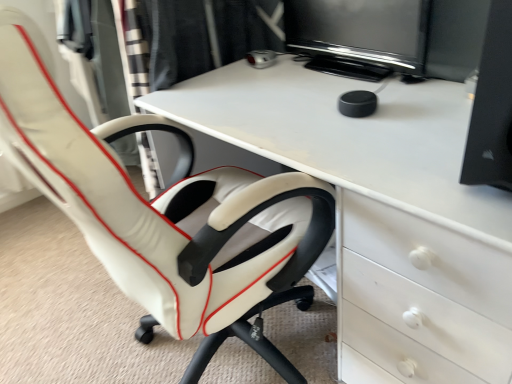
Where is `free space underneath black glossy monitor at upper center (from a real-world perspective)`? The image size is (512, 384). free space underneath black glossy monitor at upper center (from a real-world perspective) is located at coordinates (361, 74).